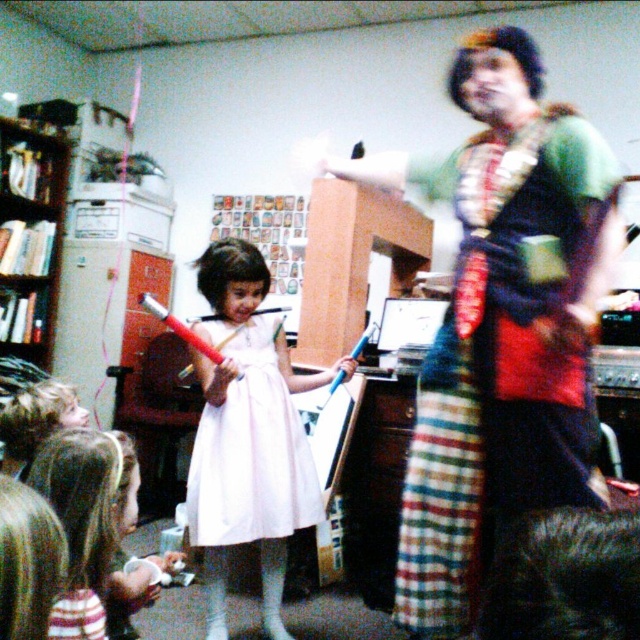
Does matte pink dress at center have a lesser width compared to white satin dress at center?

Incorrect, matte pink dress at center's width is not less than white satin dress at center's.

Between matte pink dress at center and white satin dress at center, which one appears on the left side from the viewer's perspective?

white satin dress at center

Image resolution: width=640 pixels, height=640 pixels. In order to click on matte pink dress at center in this screenshot , I will do 248,435.

Find the location of a particular element. matte pink dress at center is located at coordinates (248, 435).

Can you confirm if matte pink dress at center is taller than white fabric dress at center?

Correct, matte pink dress at center is much taller as white fabric dress at center.

Is point (220, 518) farther from viewer compared to point (108, 600)?

Yes.

Identify the location of matte pink dress at center. (248, 435).

Who is positioned more to the right, green textured dress at center or wooden bookshelf at left?

From the viewer's perspective, green textured dress at center appears more on the right side.

Can you confirm if green textured dress at center is positioned to the right of wooden bookshelf at left?

Correct, you'll find green textured dress at center to the right of wooden bookshelf at left.

Does point (464, 337) come closer to viewer compared to point (17, 161)?

Yes, it is.

Locate an element on the screen. The image size is (640, 640). green textured dress at center is located at coordinates (502, 326).